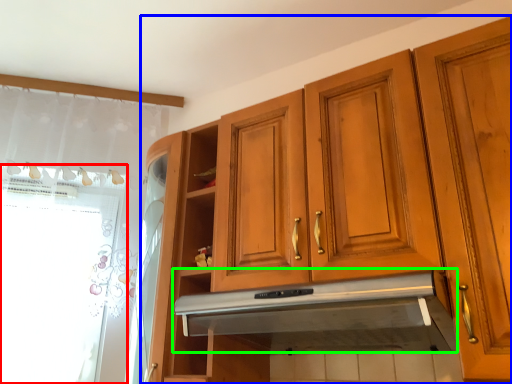
Question: Considering the real-world distances, which object is farthest from window screen (highlighted by a red box)? cabinetry (highlighted by a blue box) or exhaust hood (highlighted by a green box)?

Choices:
 (A) cabinetry
 (B) exhaust hood

Answer: (B)